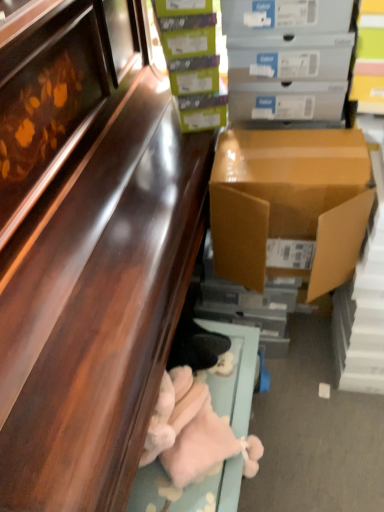
Question: Does green matte box at upper center, arranged as the 2th box when viewed from the top, appear on the left side of shiny brown cabinet at lower left?

Choices:
 (A) no
 (B) yes

Answer: (A)

Question: Does green matte box at upper center, placed as the second box when sorted from bottom to top, have a greater width compared to shiny brown cabinet at lower left?

Choices:
 (A) yes
 (B) no

Answer: (B)

Question: Can you confirm if green matte box at upper center, arranged as the 2th box when viewed from the top, is thinner than shiny brown cabinet at lower left?

Choices:
 (A) no
 (B) yes

Answer: (B)

Question: Does green matte box at upper center, arranged as the 2th box when viewed from the top, have a smaller size compared to shiny brown cabinet at lower left?

Choices:
 (A) no
 (B) yes

Answer: (B)

Question: From the image's perspective, is green matte box at upper center, arranged as the 2th box when viewed from the top, beneath shiny brown cabinet at lower left?

Choices:
 (A) no
 (B) yes

Answer: (A)

Question: In the image, is matte gray cardboard box at upper right, placed as the first box when sorted from top to bottom, on the left side or the right side of brown cardboard box at right, placed as the third box when sorted from top to bottom?

Choices:
 (A) left
 (B) right

Answer: (B)

Question: Looking at their shapes, would you say matte gray cardboard box at upper right, placed as the first box when sorted from top to bottom, is wider or thinner than brown cardboard box at right, placed as the third box when sorted from top to bottom?

Choices:
 (A) wide
 (B) thin

Answer: (B)

Question: Is point (230, 20) closer or farther from the camera than point (226, 215)?

Choices:
 (A) closer
 (B) farther

Answer: (A)

Question: From the image's perspective, is matte gray cardboard box at upper right, placed as the first box when sorted from top to bottom, positioned above or below brown cardboard box at right, placed as the third box when sorted from top to bottom?

Choices:
 (A) above
 (B) below

Answer: (A)

Question: Considering their positions, is shiny brown cabinet at lower left located in front of or behind fluffy pink stuffed animal at lower center?

Choices:
 (A) front
 (B) behind

Answer: (A)

Question: Is point (150, 74) closer or farther from the camera than point (249, 366)?

Choices:
 (A) closer
 (B) farther

Answer: (B)

Question: From a real-world perspective, is shiny brown cabinet at lower left above or below fluffy pink stuffed animal at lower center?

Choices:
 (A) above
 (B) below

Answer: (A)

Question: In terms of width, does shiny brown cabinet at lower left look wider or thinner when compared to fluffy pink stuffed animal at lower center?

Choices:
 (A) thin
 (B) wide

Answer: (B)

Question: Considering the positions of shiny brown cabinet at lower left and matte gray cardboard box at upper right, which is the 3th box in bottom-to-top order, in the image, is shiny brown cabinet at lower left taller or shorter than matte gray cardboard box at upper right, which is the 3th box in bottom-to-top order,?

Choices:
 (A) short
 (B) tall

Answer: (B)

Question: Is point pos(104,465) closer or farther from the camera than point pos(332,69)?

Choices:
 (A) closer
 (B) farther

Answer: (A)